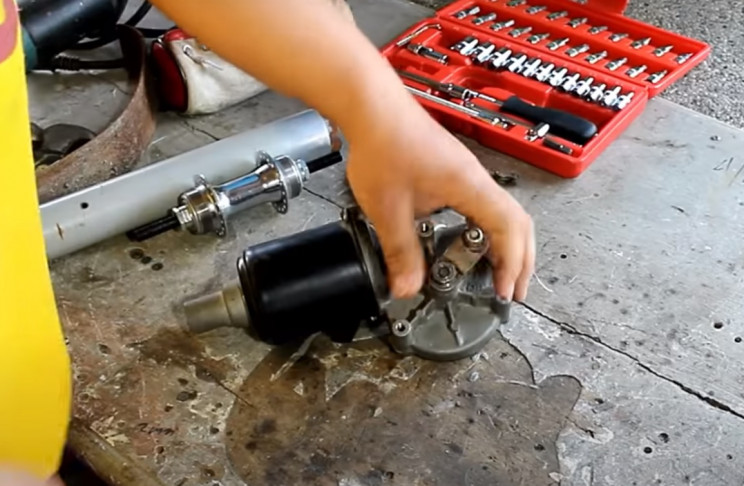
This screenshot has width=744, height=486. I want to click on light gray concrete floor, so click(651, 215).